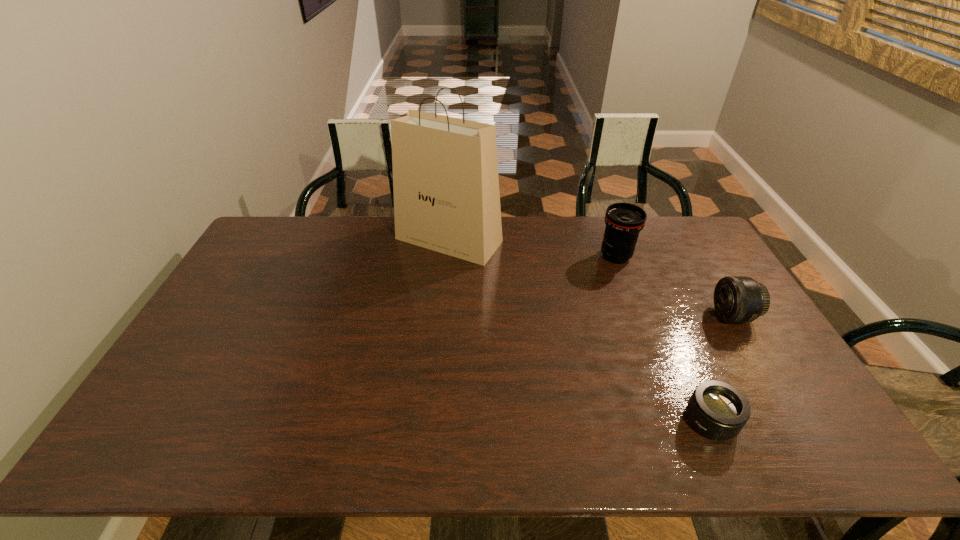
What are the coordinates of `free spot between the rightmost object and the nearest telephoto lens` in the screenshot? It's located at click(x=721, y=368).

You are a GUI agent. You are given a task and a screenshot of the screen. Output one action in this format:
    pyautogui.click(x=<x>, y=<y>)
    Task: Click on the free spot between the shortest object and the third farthest object
    
    Given the screenshot: What is the action you would take?
    pyautogui.click(x=721, y=368)

Where is `vacant space in between the leftmost object and the second tallest telephoto lens`? The height and width of the screenshot is (540, 960). vacant space in between the leftmost object and the second tallest telephoto lens is located at coordinates pos(590,278).

What are the coordinates of `free spot between the farthest telephoto lens and the shopping bag` in the screenshot? It's located at (532, 248).

Select which object is the third closest to the rightmost object. Please provide its 2D coordinates. Your answer should be formatted as a tuple, i.e. [(x, y)], where the tuple contains the x and y coordinates of a point satisfying the conditions above.

[(446, 192)]

Select which object is the third closest to the tallest object. Please provide its 2D coordinates. Your answer should be formatted as a tuple, i.e. [(x, y)], where the tuple contains the x and y coordinates of a point satisfying the conditions above.

[(718, 410)]

Identify the location of the closest telephoto lens to the shopping bag. (624, 221).

Where is `telephoto lens that is the closest to the farthest telephoto lens`? telephoto lens that is the closest to the farthest telephoto lens is located at coordinates click(738, 299).

Find the location of a particular element. free location that satisfies the following two spatial constraints: 1. on the front side of the leftmost object; 2. on the left side of the tallest telephoto lens is located at coordinates (447, 256).